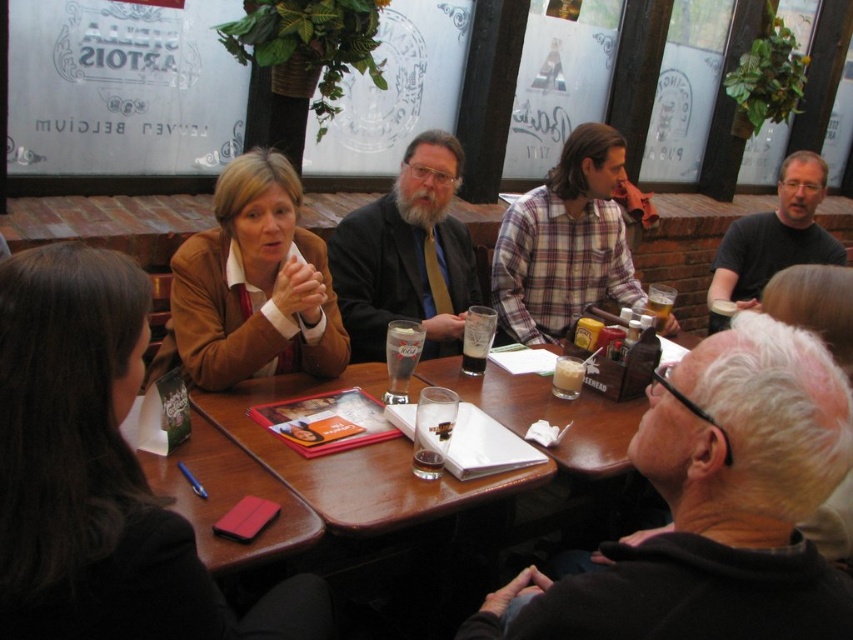
Describe the element at coordinates (410, 451) in the screenshot. I see `wooden table at center` at that location.

This screenshot has width=853, height=640. What are the coordinates of `wooden table at center` in the screenshot? It's located at (410, 451).

Which is below, black matte shirt at upper right or translucent glass beer at upper center?

translucent glass beer at upper center is below.

Is point (798, 221) positioned in front of point (656, 291)?

No, (798, 221) is behind (656, 291).

This screenshot has width=853, height=640. Describe the element at coordinates (775, 236) in the screenshot. I see `black matte shirt at upper right` at that location.

You are a GUI agent. You are given a task and a screenshot of the screen. Output one action in this format:
    pyautogui.click(x=<x>, y=<y>)
    Task: Click on the black matte shirt at upper right
    
    Given the screenshot: What is the action you would take?
    pyautogui.click(x=775, y=236)

Is wooden table at center below plaid fabric shirt at upper center?

Yes.

Describe the element at coordinates (410, 451) in the screenshot. The height and width of the screenshot is (640, 853). I see `wooden table at center` at that location.

Identify the location of wooden table at center. The height and width of the screenshot is (640, 853). (410, 451).